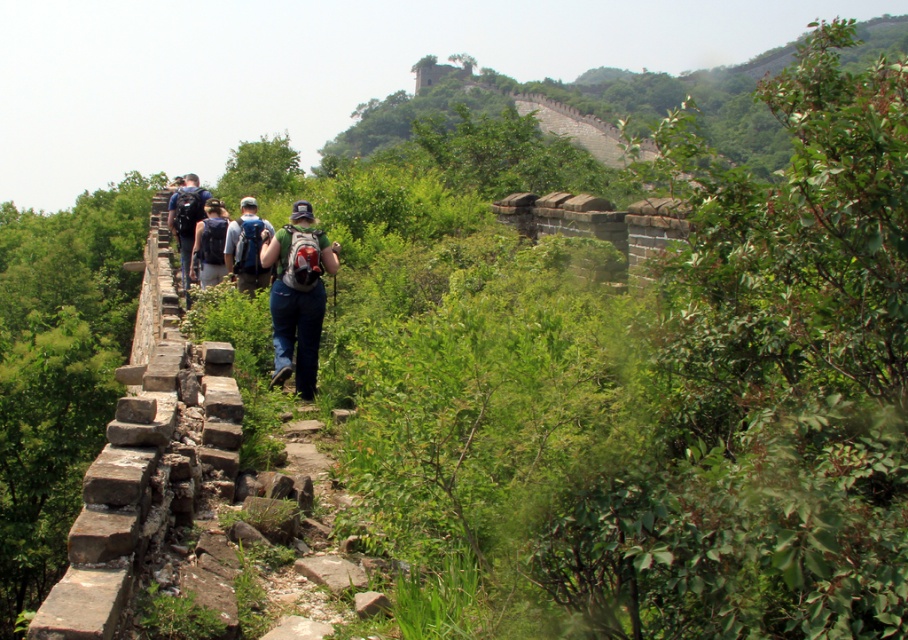
You are a photographer positioned at the base of the Great Wall. You notice a dark blue backpack at center and a dark blue jeans at center in the scene. Which object is closer to your camera lens?

The dark blue backpack at center is closer to the camera lens because it is positioned in front of the dark blue jeans at center.

From the picture: You are a hiker planning to carry both the matte gray backpack at center and the dark blue backpack at center on the narrow path of the Great Wall. Considering the path is only 1 meter wide, which backpack should you place closer to the wall to avoid blocking the path?

The matte gray backpack at center is shorter than the dark blue backpack at center, so placing the matte gray backpack at center closer to the wall would allow the taller dark blue backpack at center to be carried in the center of the path, minimizing obstruction for other hikers.